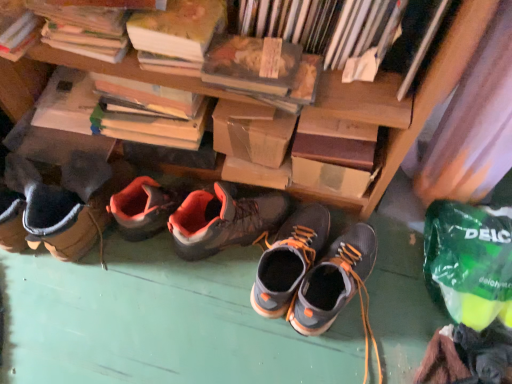
You are a GUI agent. You are given a task and a screenshot of the screen. Output one action in this format:
    pyautogui.click(x=<x>, y=<y>)
    Task: Click on the vacant area that lies between orange suede hiking boots at center, which ranks as the 1th footwear in left-to-right order, and dark gray suede shoes at center, which appears as the second footwear when viewed from the right
    The width and height of the screenshot is (512, 384).
    Given the screenshot: What is the action you would take?
    pyautogui.click(x=227, y=277)